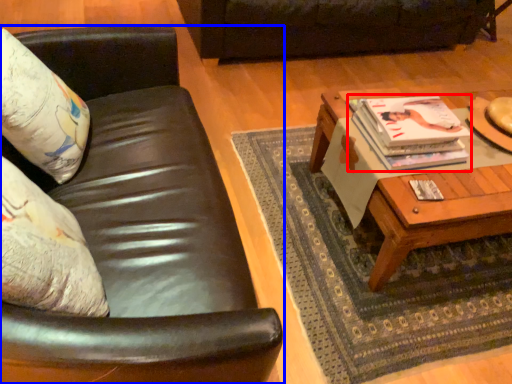
Question: Which object appears closest to the camera in this image, magazine (highlighted by a red box) or studio couch (highlighted by a blue box)?

Choices:
 (A) magazine
 (B) studio couch

Answer: (B)